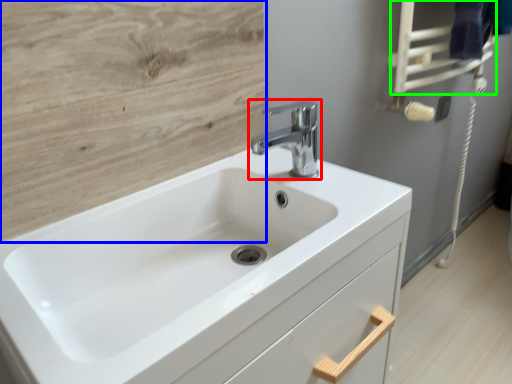
Question: Considering the real-world distances, which object is closest to tap (highlighted by a red box)? plywood (highlighted by a blue box) or towel bar (highlighted by a green box).

Choices:
 (A) plywood
 (B) towel bar

Answer: (A)